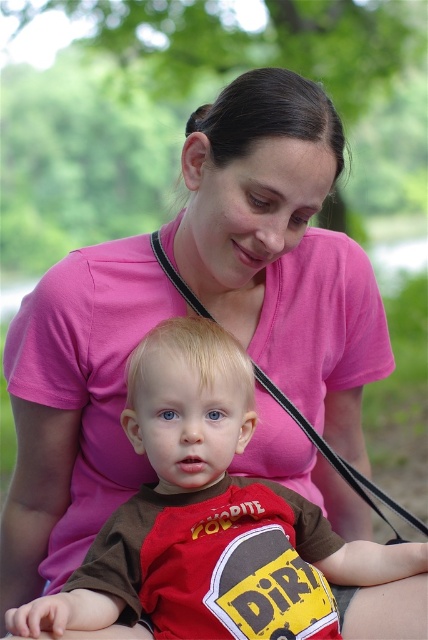
Question: Can you confirm if brown cotton shirt at center is smaller than black leather strap at center?

Choices:
 (A) yes
 (B) no

Answer: (A)

Question: Is brown cotton shirt at center further to camera compared to black leather strap at center?

Choices:
 (A) yes
 (B) no

Answer: (B)

Question: Among these points, which one is farthest from the camera?

Choices:
 (A) (342, 460)
 (B) (210, 541)

Answer: (A)

Question: Can you confirm if brown cotton shirt at center is smaller than black leather strap at center?

Choices:
 (A) no
 (B) yes

Answer: (B)